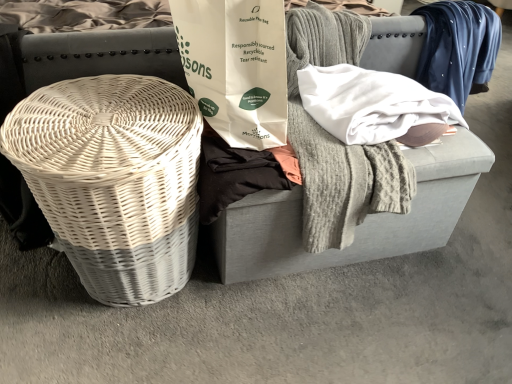
Find the location of a particular element. The width and height of the screenshot is (512, 384). vacant area that is in front of white wicker basket at left is located at coordinates (112, 351).